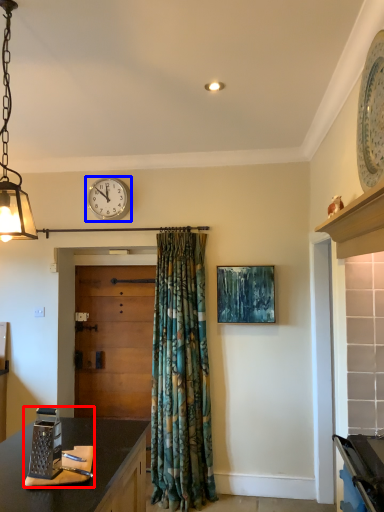
Question: Which point is closer to the camera, appliance (highlighted by a red box) or wall clock (highlighted by a blue box)?

Choices:
 (A) appliance
 (B) wall clock

Answer: (A)